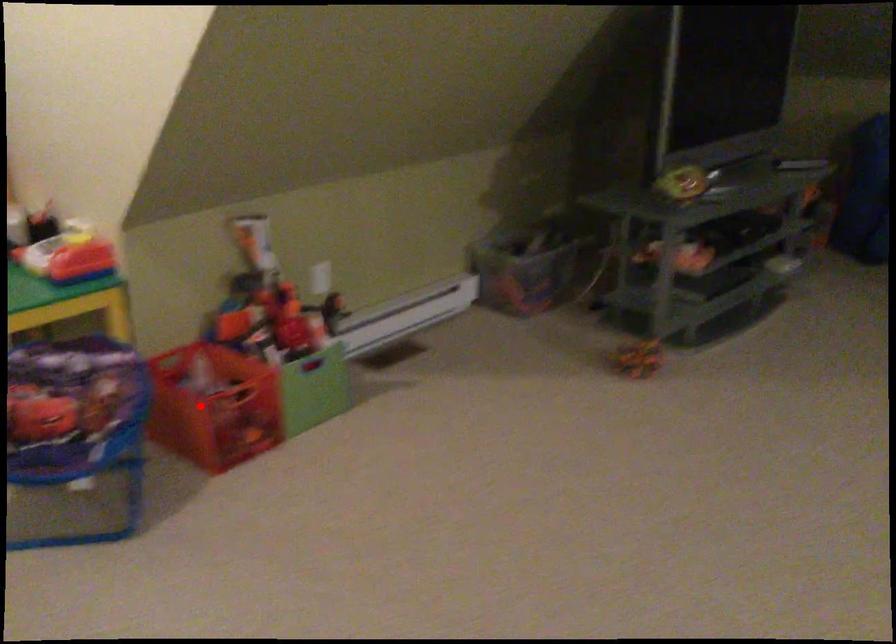
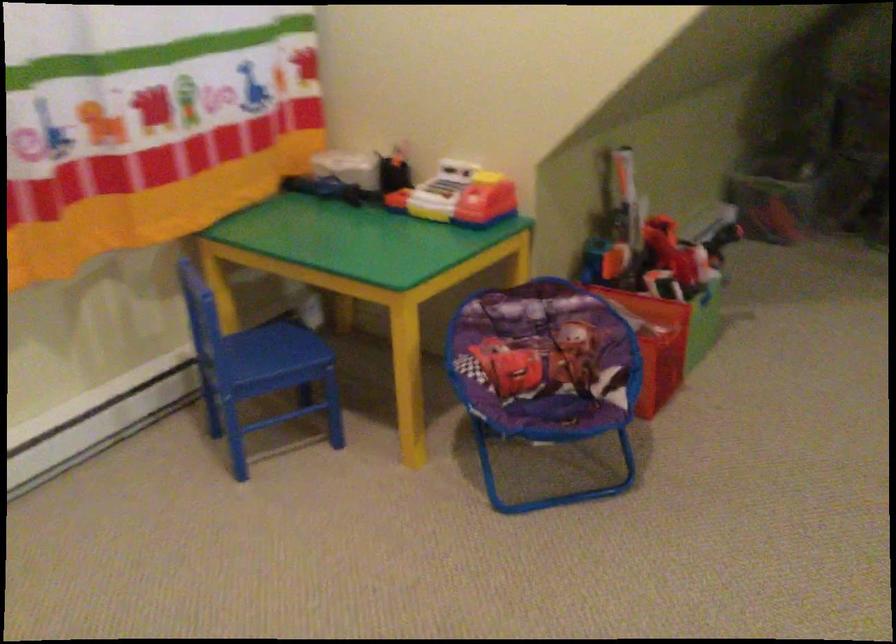
Question: I am providing you with two images of the same scene from different viewpoints. A red point is shown in image1. For the corresponding object point in image2, is it positioned nearer or farther from the camera?

Choices:
 (A) Nearer
 (B) Farther

Answer: (A)